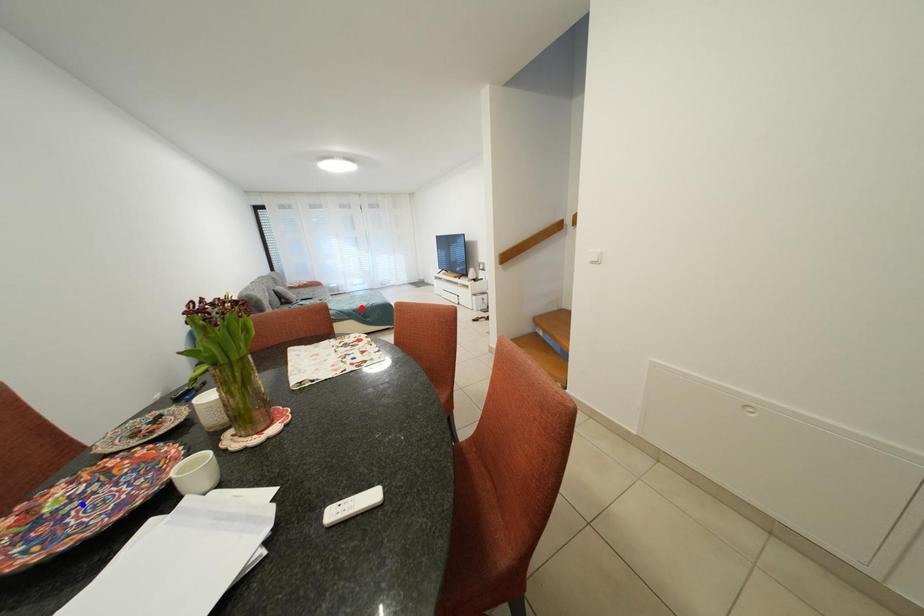
Question: In the image, two points are highlighted. Which point is nearer to the camera? Reply with the corresponding letter.

Choices:
 (A) blue point
 (B) red point

Answer: (A)